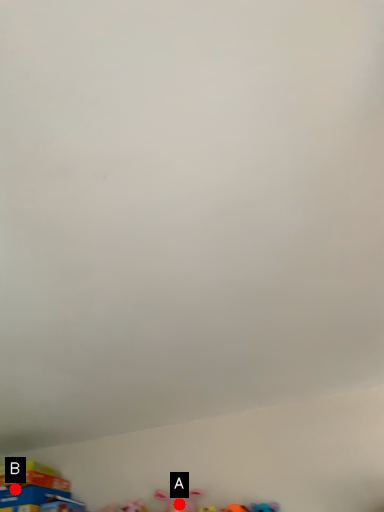
Question: Two points are circled on the image, labeled by A and B beside each circle. Which of the following is the farthest from the observer?

Choices:
 (A) A is further
 (B) B is further

Answer: (B)